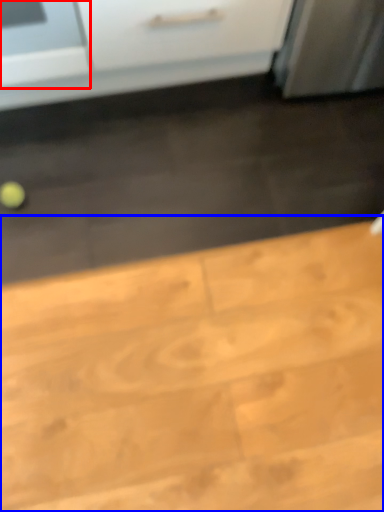
Question: Which object appears farthest to the camera in this image, appliance (highlighted by a red box) or table (highlighted by a blue box)?

Choices:
 (A) appliance
 (B) table

Answer: (A)